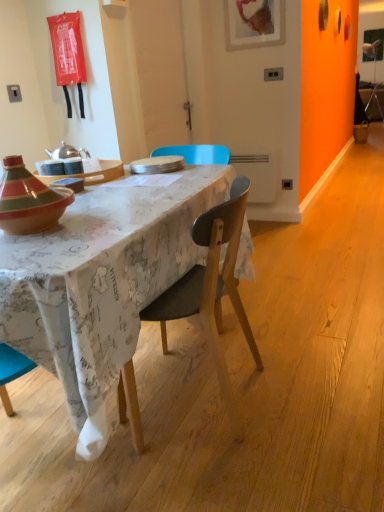
Question: Does white matte plate at center have a lesser width compared to wooden chair at center?

Choices:
 (A) no
 (B) yes

Answer: (B)

Question: From the image's perspective, is white matte plate at center above wooden chair at center?

Choices:
 (A) yes
 (B) no

Answer: (A)

Question: Is white matte plate at center oriented away from wooden chair at center?

Choices:
 (A) yes
 (B) no

Answer: (B)

Question: From a real-world perspective, is white matte plate at center on wooden chair at center?

Choices:
 (A) yes
 (B) no

Answer: (A)

Question: Is white matte plate at center positioned in front of wooden chair at center?

Choices:
 (A) yes
 (B) no

Answer: (B)

Question: Considering the positions of matte wooden tray at center and white matte plate at center in the image, is matte wooden tray at center wider or thinner than white matte plate at center?

Choices:
 (A) thin
 (B) wide

Answer: (B)

Question: Considering their positions, is matte wooden tray at center located in front of or behind white matte plate at center?

Choices:
 (A) front
 (B) behind

Answer: (A)

Question: Considering the positions of matte wooden tray at center and white matte plate at center in the image, is matte wooden tray at center taller or shorter than white matte plate at center?

Choices:
 (A) short
 (B) tall

Answer: (B)

Question: From the image's perspective, is matte wooden tray at center above or below white matte plate at center?

Choices:
 (A) below
 (B) above

Answer: (A)

Question: Does point (41, 242) appear closer or farther from the camera than point (150, 157)?

Choices:
 (A) closer
 (B) farther

Answer: (A)

Question: In terms of width, does maple wood desk at center look wider or thinner when compared to white matte plate at center?

Choices:
 (A) thin
 (B) wide

Answer: (B)

Question: From a real-world perspective, relative to white matte plate at center, is maple wood desk at center vertically above or below?

Choices:
 (A) below
 (B) above

Answer: (A)

Question: Is maple wood desk at center inside the boundaries of white matte plate at center, or outside?

Choices:
 (A) inside
 (B) outside

Answer: (B)

Question: Considering their positions, is maple wood desk at center located in front of or behind wooden chair at center?

Choices:
 (A) front
 (B) behind

Answer: (A)

Question: From a real-world perspective, is maple wood desk at center positioned above or below wooden chair at center?

Choices:
 (A) above
 (B) below

Answer: (B)